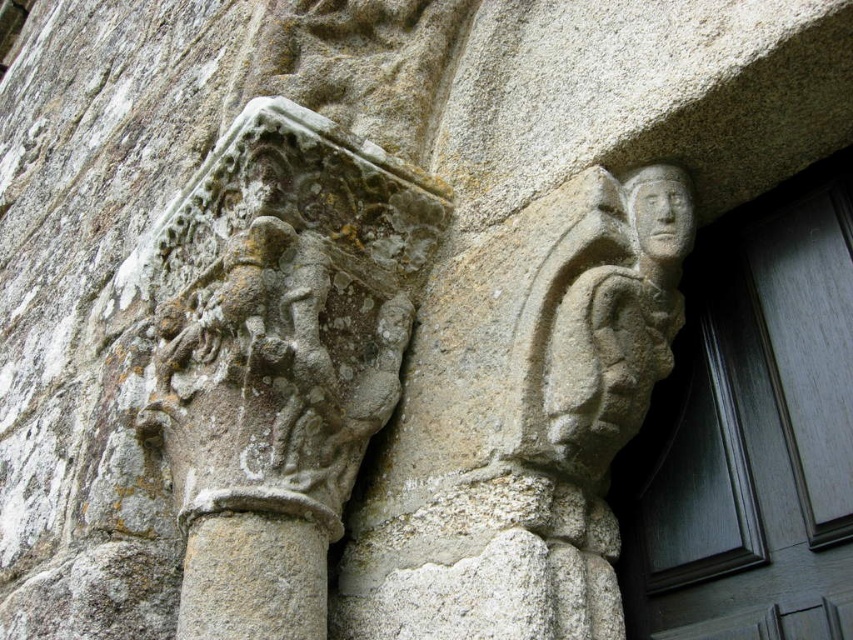
Is gray stone figure at upper right bigger than gray stone column at center?

Indeed, gray stone figure at upper right has a larger size compared to gray stone column at center.

Which of these two, gray stone figure at upper right or gray stone column at center, stands shorter?

gray stone column at center is shorter.

I want to click on gray stone figure at upper right, so (520, 420).

Between point (276, 566) and point (242, 634), which one is positioned behind?

The point (276, 566) is more distant.

Is gray stone carving at upper left taller than gray stone column at center?

Indeed, gray stone carving at upper left has a greater height compared to gray stone column at center.

Is point (244, 340) closer to viewer compared to point (218, 516)?

That is False.

The width and height of the screenshot is (853, 640). I want to click on gray stone carving at upper left, so click(279, 355).

From the picture: Can you confirm if gray stone figure at upper right is taller than gray stone carving at upper left?

Incorrect, gray stone figure at upper right's height is not larger of gray stone carving at upper left's.

Where is `gray stone figure at upper right`? gray stone figure at upper right is located at coordinates (520, 420).